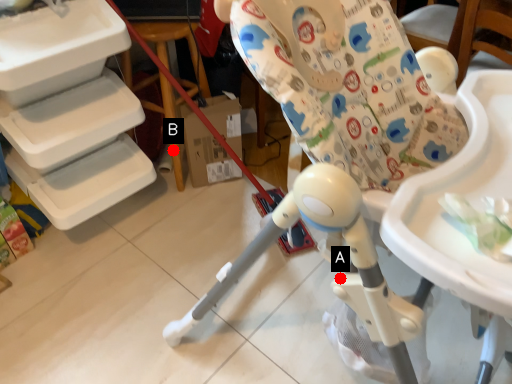
Question: Two points are circled on the image, labeled by A and B beside each circle. Which point appears farthest from the camera in this image?

Choices:
 (A) A is further
 (B) B is further

Answer: (B)